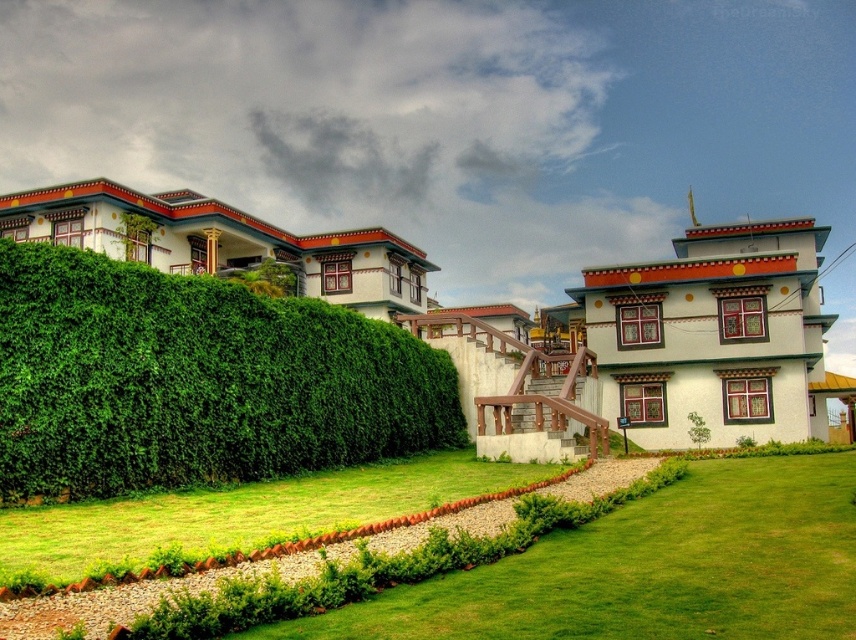
Question: Which of the following is the farthest from the observer?

Choices:
 (A) green grass at center
 (B) green leafy hedge at left

Answer: (B)

Question: Which point is closer to the camera taking this photo?

Choices:
 (A) (806, 605)
 (B) (218, 435)

Answer: (A)

Question: Is green leafy hedge at left wider than green grass at center?

Choices:
 (A) yes
 (B) no

Answer: (B)

Question: From the image, what is the correct spatial relationship of green leafy hedge at left in relation to green grass at center?

Choices:
 (A) right
 (B) left

Answer: (B)

Question: Is green leafy hedge at left to the right of green grass at center from the viewer's perspective?

Choices:
 (A) yes
 (B) no

Answer: (B)

Question: Which point is farther to the camera?

Choices:
 (A) green leafy hedge at left
 (B) green grass at center

Answer: (A)